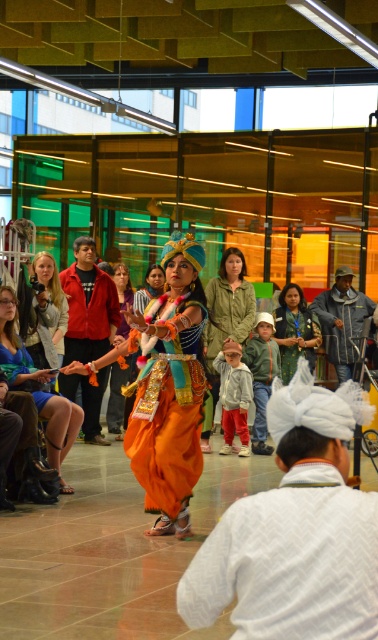
Is point (223, 349) less distant than point (128, 289)?

Yes, it is.

Between point (246, 403) and point (113, 388), which one is positioned in front?

Point (246, 403) is in front.

What do you see at coordinates (233, 396) in the screenshot? I see `red velvet pants at center` at bounding box center [233, 396].

Locate an element on the screen. red velvet pants at center is located at coordinates (233, 396).

Does matte black camera at upper left have a smaller size compared to red velvet pants at center?

No, matte black camera at upper left is not smaller than red velvet pants at center.

Is matte black camera at upper left further to camera compared to red velvet pants at center?

No, matte black camera at upper left is closer to the viewer.

Who is more distant from viewer, (46, 326) or (246, 445)?

The point (246, 445) is more distant.

Where is `matte black camera at upper left`? matte black camera at upper left is located at coordinates (46, 316).

Is white textured turban at lower center closer to the viewer compared to green fabric dress at center?

Yes, white textured turban at lower center is closer to the viewer.

Who is higher up, white textured turban at lower center or green fabric dress at center?

green fabric dress at center

Where is `white textured turban at lower center`? The height and width of the screenshot is (640, 378). white textured turban at lower center is located at coordinates (294, 532).